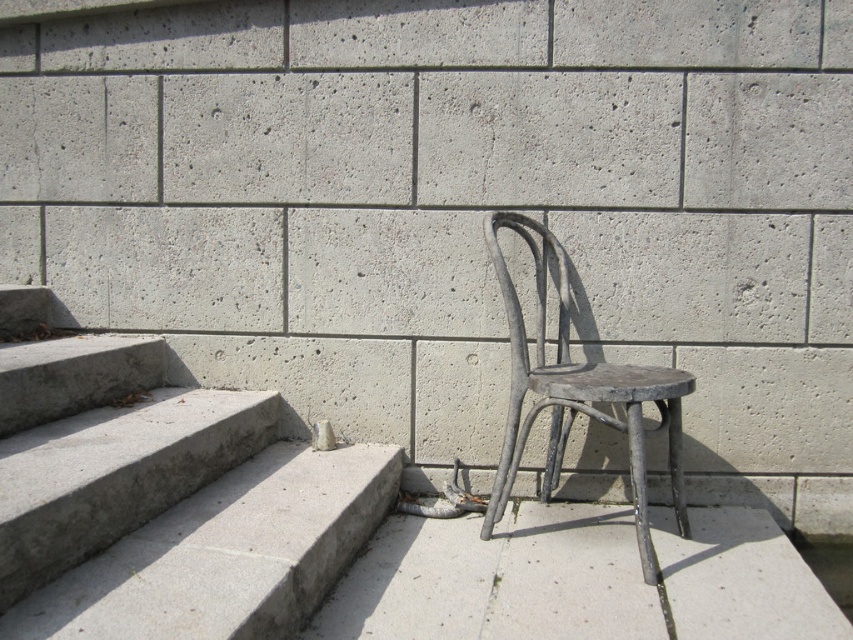
Question: Is the position of gray concrete at lower right less distant than that of rusty metal chair at center?

Choices:
 (A) no
 (B) yes

Answer: (B)

Question: Which of these objects is positioned closest to the rusty metal chair at center?

Choices:
 (A) gray concrete stairs at lower left
 (B) gray concrete at lower right

Answer: (B)

Question: Does gray concrete stairs at lower left have a smaller size compared to gray concrete at lower right?

Choices:
 (A) no
 (B) yes

Answer: (A)

Question: Which object is positioned closest to the gray concrete stairs at lower left?

Choices:
 (A) gray concrete at lower right
 (B) rusty metal chair at center

Answer: (A)

Question: Is gray concrete stairs at lower left to the right of rusty metal chair at center from the viewer's perspective?

Choices:
 (A) yes
 (B) no

Answer: (B)

Question: Which is nearer to the gray concrete at lower right?

Choices:
 (A) rusty metal chair at center
 (B) gray concrete stairs at lower left

Answer: (A)